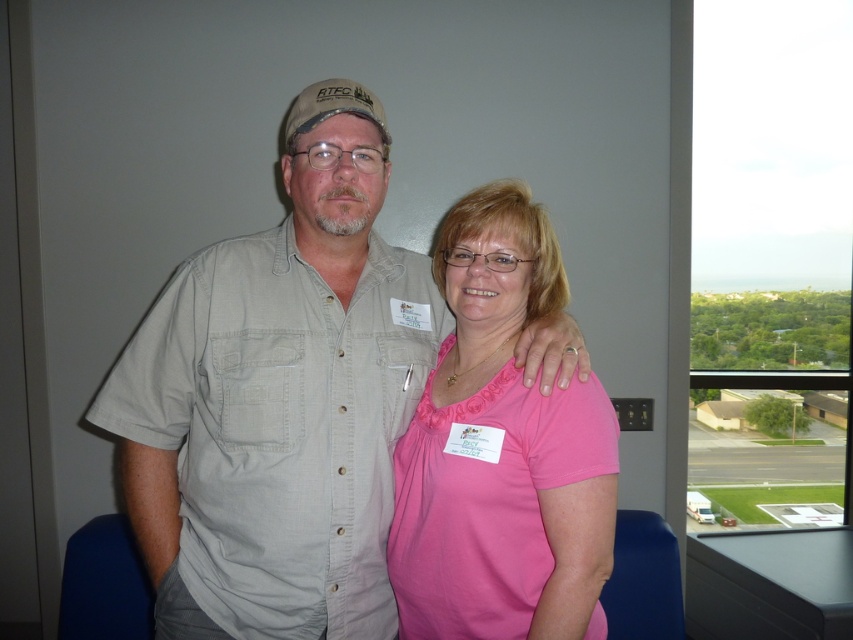
You are designing a new layout for a clothing store and need to arrange two shirts on a mannequin stand. The matte khaki shirt at center and the pink matte shirt at center must be displayed. Given their sizes, which shirt should be placed on the upper part of the stand to ensure proper visibility?

The matte khaki shirt at center is larger in size than the pink matte shirt at center, so placing the larger matte khaki shirt at center on the upper part of the stand will ensure it is more visible while the smaller pink matte shirt at center can be placed below.

You are taking a photo of two people standing in an office. You notice two points marked in the image at coordinates point (x=253, y=332) and point (x=573, y=452). Which point is closer to the camera?

Point (x=573, y=452) is closer to the camera because it is less further than point (x=253, y=332).

You are organizing a photoshoot and need to arrange two shirts on a mannequin stand. The stand has a width limit of 1.2 meters. Given that the matte khaki shirt at center and the pink matte shirt at center are to be placed side by side, can both shirts fit on the stand without overlapping?

The matte khaki shirt at center might be wider than pink matte shirt at center. Since the exact widths are not provided, it is uncertain if both will fit within the 1.2 meter limit. Check the actual measurements before placing them.